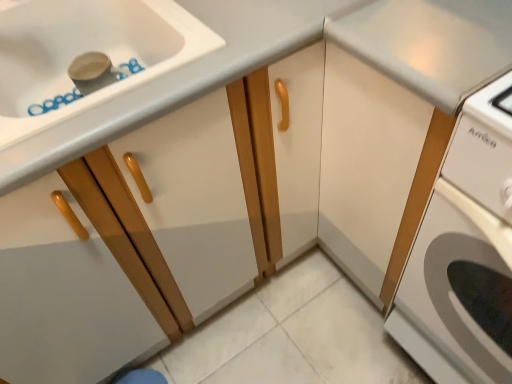
At what (x,y) coordinates should I click in order to perform the action: click on free space above white matte cabinet at center, placed as the 1th cabinetry when sorted from right to left (from a real-world perspective). Please return your answer as a coordinate pair (x, y). The image size is (512, 384). Looking at the image, I should click on (451, 22).